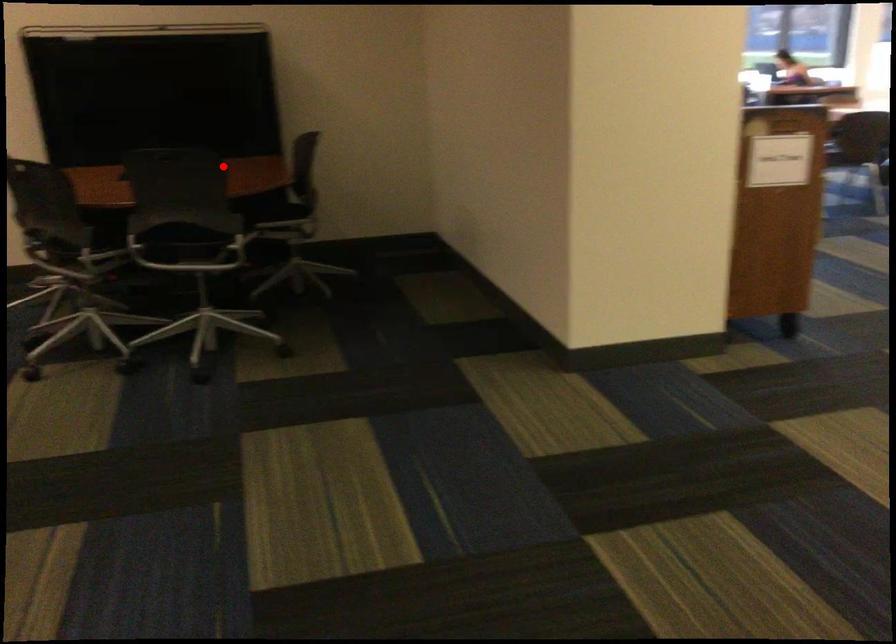
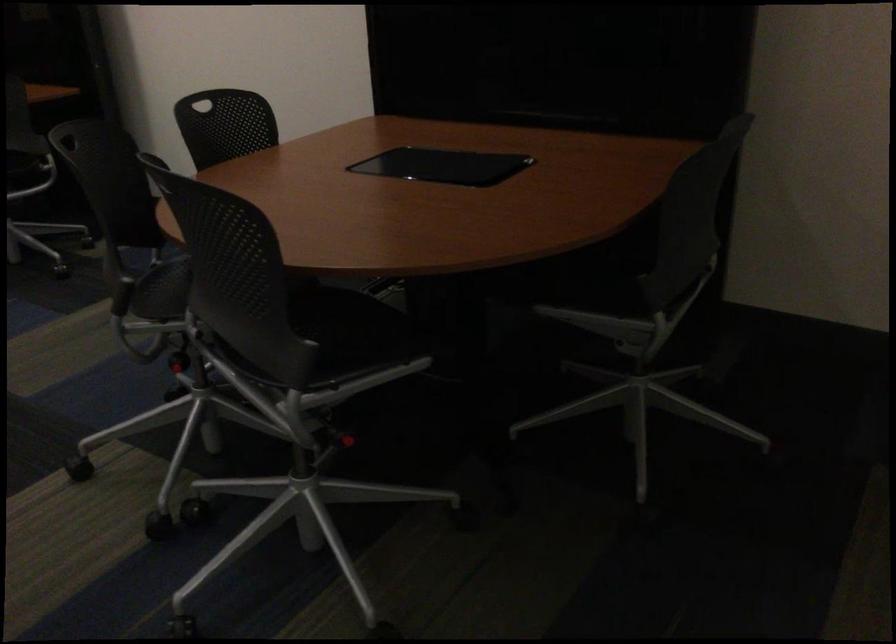
In the second image, find the point that corresponds to the highlighted location in the first image.

(612, 272)